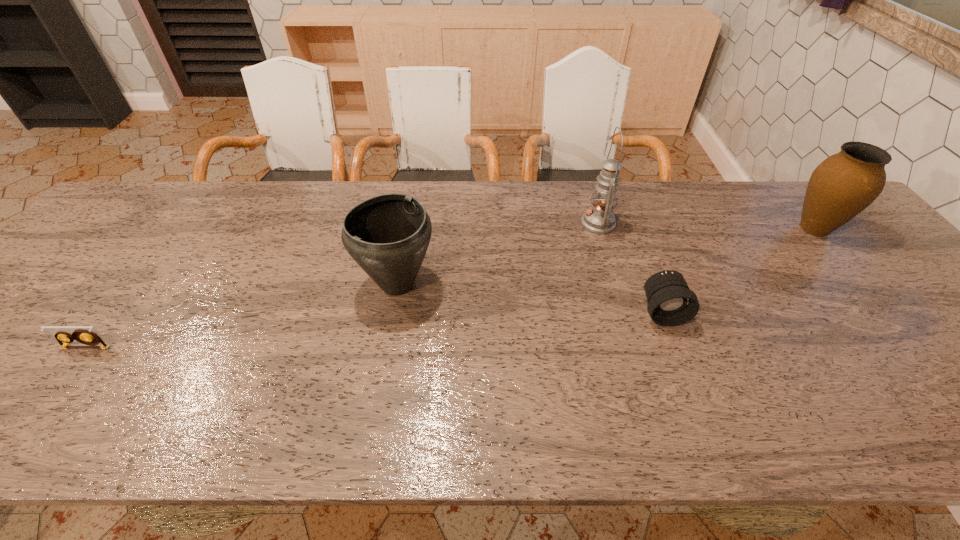
This screenshot has width=960, height=540. Find the location of `free space between the nearer urn and the right urn`. free space between the nearer urn and the right urn is located at coordinates (606, 256).

This screenshot has height=540, width=960. What are the coordinates of `vacant space that is in between the nearer urn and the rightmost object` in the screenshot? It's located at (606, 256).

Locate which object is the fourth closest to the tallest object. Please provide its 2D coordinates. Your answer should be formatted as a tuple, i.e. [(x, y)], where the tuple contains the x and y coordinates of a point satisfying the conditions above.

[(82, 335)]

Identify which object is the closest to the fourth tallest object. Please provide its 2D coordinates. Your answer should be formatted as a tuple, i.e. [(x, y)], where the tuple contains the x and y coordinates of a point satisfying the conditions above.

[(599, 219)]